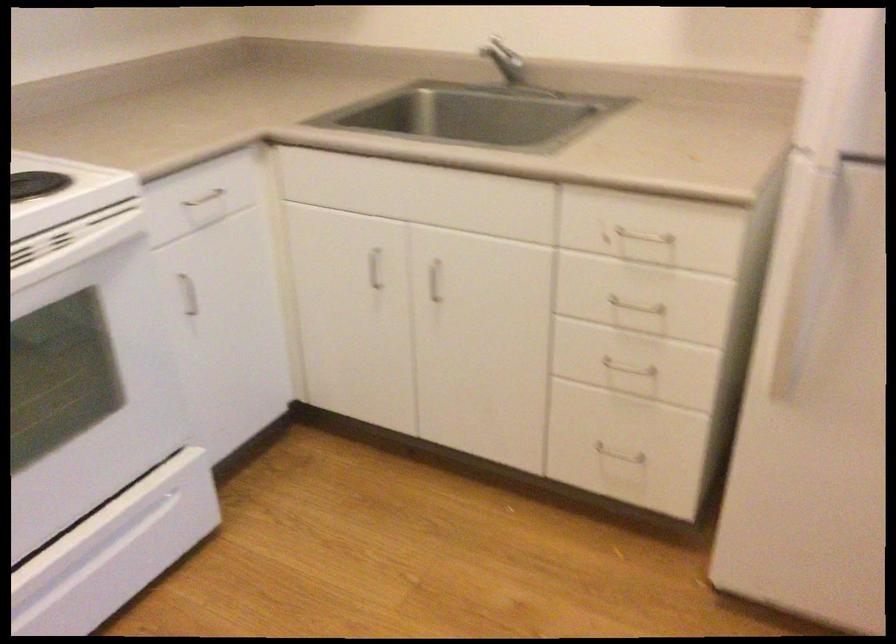
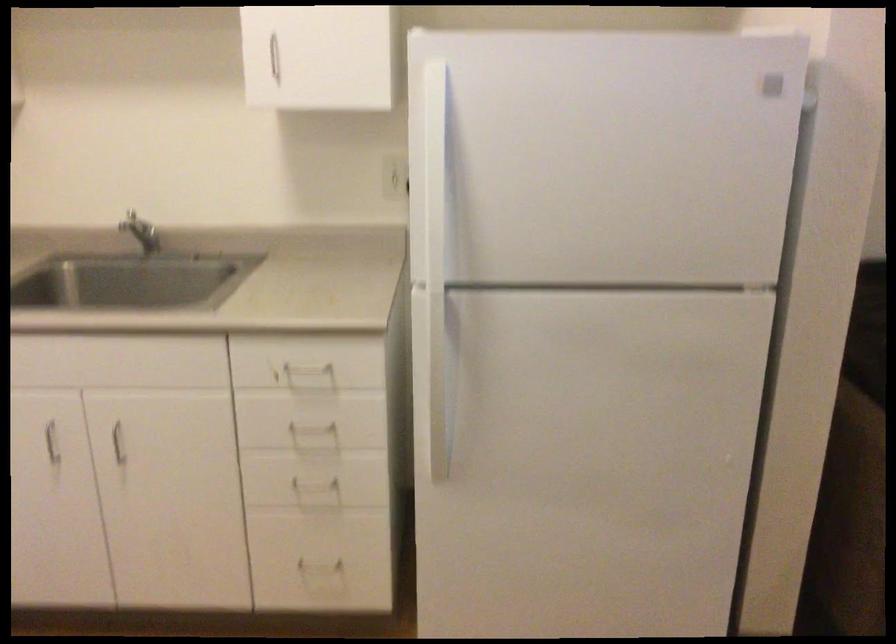
The point at (433,267) is marked in the first image. Where is the corresponding point in the second image?

(116, 430)